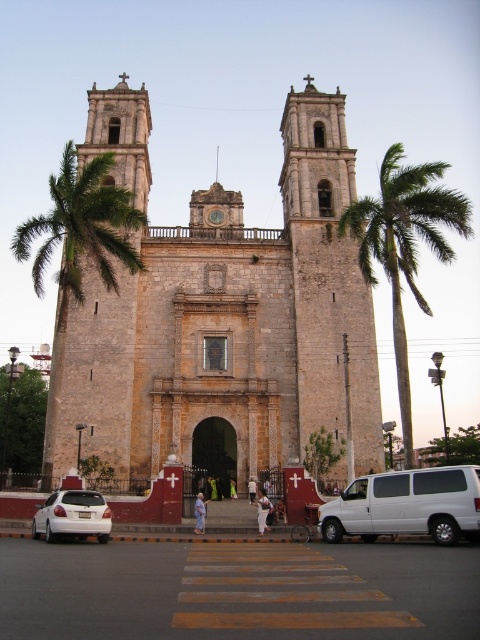
Consider the image. You are a photographer standing at the lower left corner of the church. You want to capture a photo of the stone bell tower at center without any obstructions. Since there is a white matte sedan at lower left in your way, can you move around it to get a clear shot? Please explain.

The stone bell tower at center is much taller than the white matte sedan at lower left. Since the sedan is shorter, you can move around it to position yourself where the sedan no longer blocks your view of the tower.

You are standing at the point marked as point (382,244) and want to take a photo of the historic church. The camera you are using has a maximum range of 200 feet. Will you be able to capture the church in your photo?

The distance between point (382,244) and the camera is 222.37 feet, which exceeds the camera maximum range of 200 feet. Therefore, you won not be able to capture the church in your photo.

You are standing in front of the grand historic church and notice a specific point marked at coordinates [327,280]. What object is located at this point?

The point at coordinates [327,280] is where the stone bell tower at center is located.